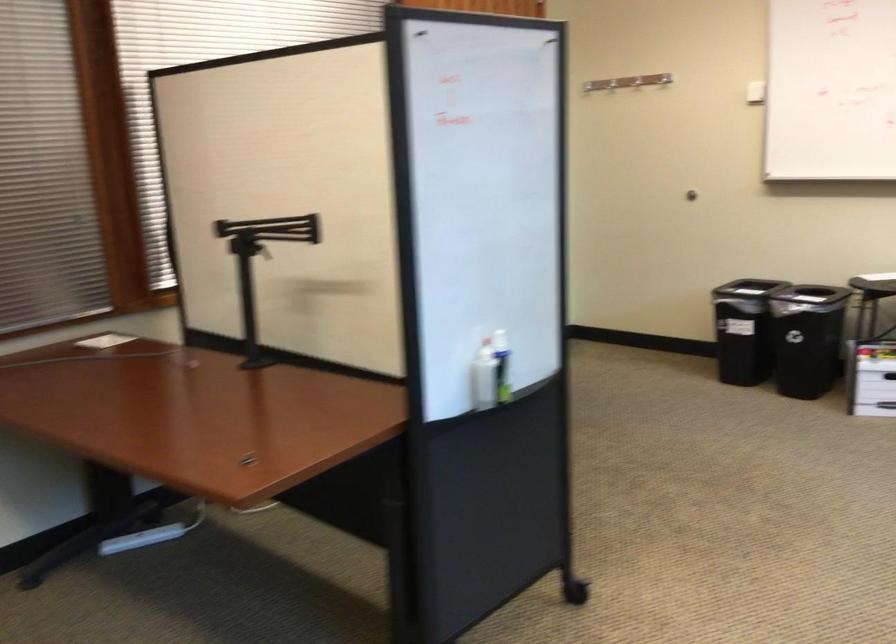
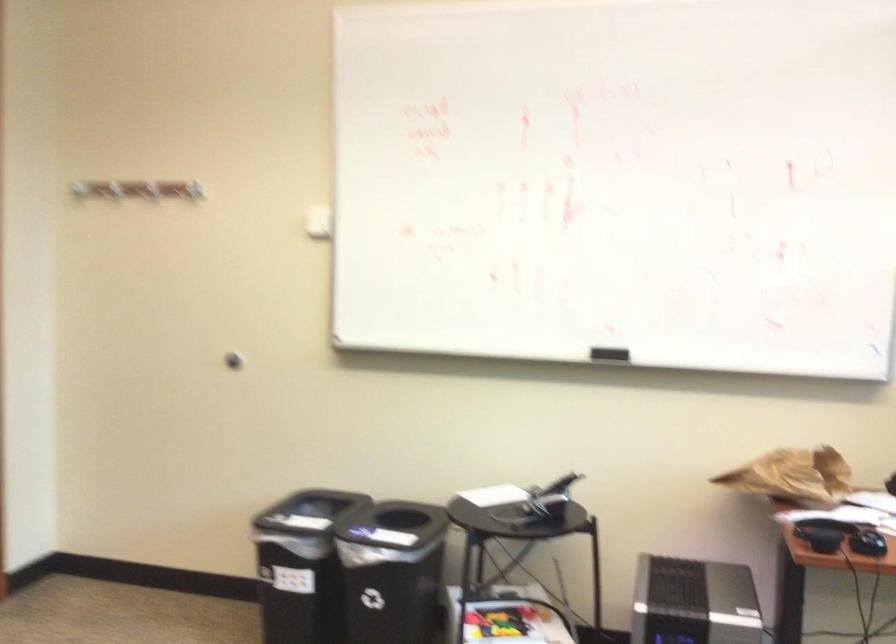
The images are taken continuously from a first-person perspective. In which direction are you moving?

The cameraman moved toward right, forward.